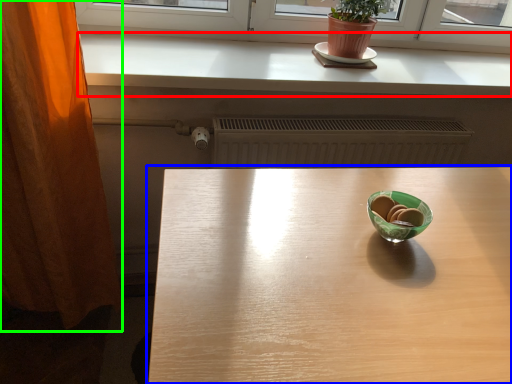
Question: Based on their relative distances, which object is farther from counter top (highlighted by a red box)? Choose from table (highlighted by a blue box) and curtain (highlighted by a green box).

Choices:
 (A) table
 (B) curtain

Answer: (A)